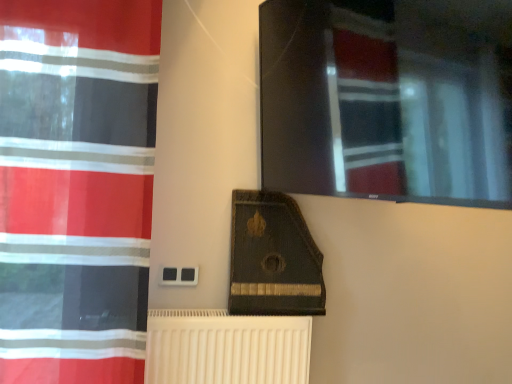
What do you see at coordinates (226, 348) in the screenshot? The width and height of the screenshot is (512, 384). I see `white ribbed radiator at lower center` at bounding box center [226, 348].

What are the coordinates of `white ribbed radiator at lower center` in the screenshot? It's located at (226, 348).

Describe the element at coordinates (76, 188) in the screenshot. The height and width of the screenshot is (384, 512). I see `red striped curtain at left` at that location.

Where is `red striped curtain at left`? red striped curtain at left is located at coordinates (76, 188).

Locate an element on the screen. This screenshot has width=512, height=384. white ribbed radiator at lower center is located at coordinates (226, 348).

Looking at this image, which object is positioned more to the left, red striped curtain at left or white ribbed radiator at lower center?

red striped curtain at left is more to the left.

Which is in front, red striped curtain at left or white ribbed radiator at lower center?

red striped curtain at left is closer to the camera.

Which is in front, point (94, 376) or point (198, 360)?

The point (94, 376) is closer.

From the image's perspective, is red striped curtain at left on top of white ribbed radiator at lower center?

Yes, from the image's perspective, red striped curtain at left is above white ribbed radiator at lower center.

From a real-world perspective, does red striped curtain at left sit lower than white ribbed radiator at lower center?

No, from a real-world perspective, red striped curtain at left is not below white ribbed radiator at lower center.

Consider the image. Between red striped curtain at left and white ribbed radiator at lower center, which one has larger width?

Wider between the two is white ribbed radiator at lower center.

From the picture: In terms of height, does red striped curtain at left look taller or shorter compared to white ribbed radiator at lower center?

Clearly, red striped curtain at left is taller compared to white ribbed radiator at lower center.

Does red striped curtain at left have a larger size compared to white ribbed radiator at lower center?

Correct, red striped curtain at left is larger in size than white ribbed radiator at lower center.

Is red striped curtain at left surrounding white ribbed radiator at lower center?

No, white ribbed radiator at lower center is not inside red striped curtain at left.

Is red striped curtain at left far from white ribbed radiator at lower center?

No, there isn't a large distance between red striped curtain at left and white ribbed radiator at lower center.

Is white ribbed radiator at lower center at the back of red striped curtain at left?

red striped curtain at left does not have its back to white ribbed radiator at lower center.

Can you tell me how much red striped curtain at left and white ribbed radiator at lower center differ in facing direction?

The angular difference between red striped curtain at left and white ribbed radiator at lower center is 1.77 degrees.

Where is `curtain that is in front of the white ribbed radiator at lower center`? curtain that is in front of the white ribbed radiator at lower center is located at coordinates (76, 188).

Is white ribbed radiator at lower center at the right side of red striped curtain at left?

Indeed, white ribbed radiator at lower center is positioned on the right side of red striped curtain at left.

Between white ribbed radiator at lower center and red striped curtain at left, which one is positioned in front?

Positioned in front is red striped curtain at left.

Considering the points (150, 339) and (88, 262), which point is in front, point (150, 339) or point (88, 262)?

The point (88, 262) is more forward.

From the image's perspective, which is above, white ribbed radiator at lower center or red striped curtain at left?

From the image's view, red striped curtain at left is above.

From a real-world perspective, who is located higher, white ribbed radiator at lower center or red striped curtain at left?

red striped curtain at left.

Considering the relative sizes of white ribbed radiator at lower center and red striped curtain at left in the image provided, is white ribbed radiator at lower center wider than red striped curtain at left?

Indeed, white ribbed radiator at lower center has a greater width compared to red striped curtain at left.

Who is shorter, white ribbed radiator at lower center or red striped curtain at left?

white ribbed radiator at lower center is shorter.

Considering the sizes of objects white ribbed radiator at lower center and red striped curtain at left in the image provided, who is smaller, white ribbed radiator at lower center or red striped curtain at left?

With smaller size is white ribbed radiator at lower center.

Is white ribbed radiator at lower center spatially inside red striped curtain at left, or outside of it?

white ribbed radiator at lower center lies outside red striped curtain at left.

Is white ribbed radiator at lower center not close to red striped curtain at left?

No, white ribbed radiator at lower center is not far from red striped curtain at left.

Is white ribbed radiator at lower center oriented away from red striped curtain at left?

That's not correct — white ribbed radiator at lower center is not looking away from red striped curtain at left.

Locate an element on the screen. The image size is (512, 384). curtain above the white ribbed radiator at lower center (from the image's perspective) is located at coordinates (76, 188).

I want to click on radiator located below the red striped curtain at left (from the image's perspective), so click(226, 348).

Identify the location of radiator directly beneath the red striped curtain at left (from a real-world perspective). 226,348.